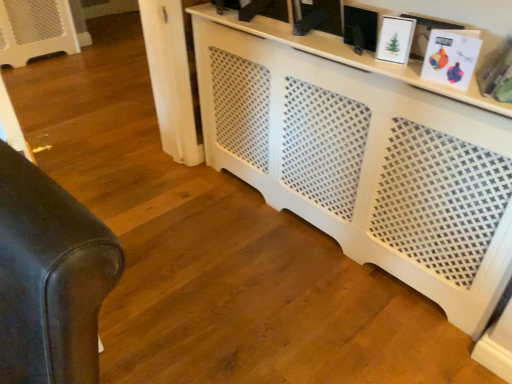
The height and width of the screenshot is (384, 512). Identify the location of vacant area on the back side of leather couch at left. (152, 210).